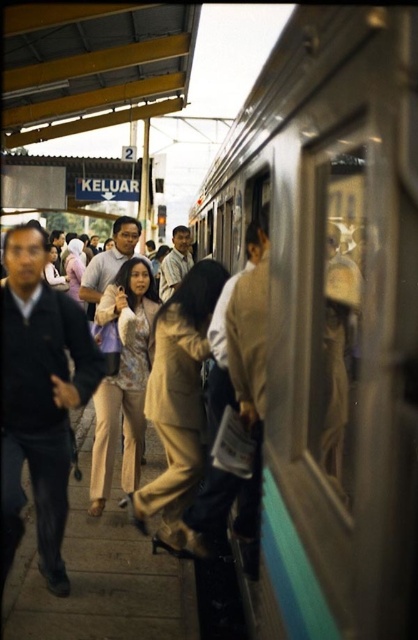
Question: Among these objects, which one is farthest from the camera?

Choices:
 (A) tan fabric pants at center
 (B) silver metallic train at center

Answer: (A)

Question: Does dark blue fabric jacket at left appear on the right side of tan fabric pants at center?

Choices:
 (A) yes
 (B) no

Answer: (B)

Question: Which point is closer to the camera?

Choices:
 (A) (35, 273)
 (B) (190, 380)
 (C) (402, 305)

Answer: (C)

Question: Can you confirm if silver metallic train at center is wider than beige fabric dress at center?

Choices:
 (A) no
 (B) yes

Answer: (B)

Question: Which of these objects is positioned farthest from the tan fabric pants at center?

Choices:
 (A) beige fabric dress at center
 (B) dark blue fabric jacket at left
 (C) silver metallic train at center

Answer: (C)

Question: Is dark blue fabric jacket at left in front of beige fabric dress at center?

Choices:
 (A) no
 (B) yes

Answer: (B)